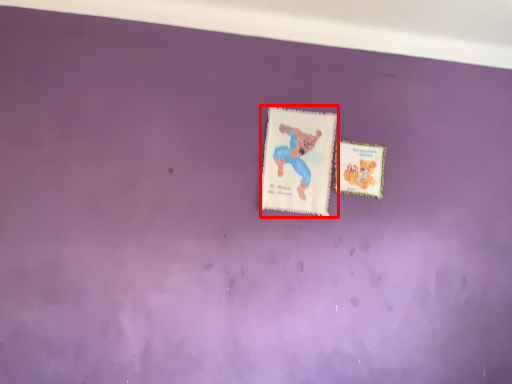
Question: From the image's perspective, what is the correct spatial relationship of postcard (annotated by the red box) in relation to postcard?

Choices:
 (A) below
 (B) above

Answer: (B)